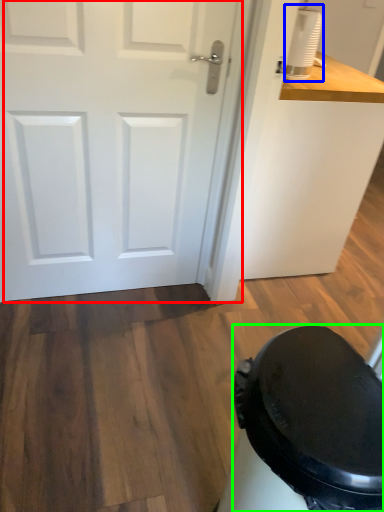
Question: Which object is the farthest from door (highlighted by a red box)? Choose among these: appliance (highlighted by a blue box) or potty (highlighted by a green box).

Choices:
 (A) appliance
 (B) potty

Answer: (B)